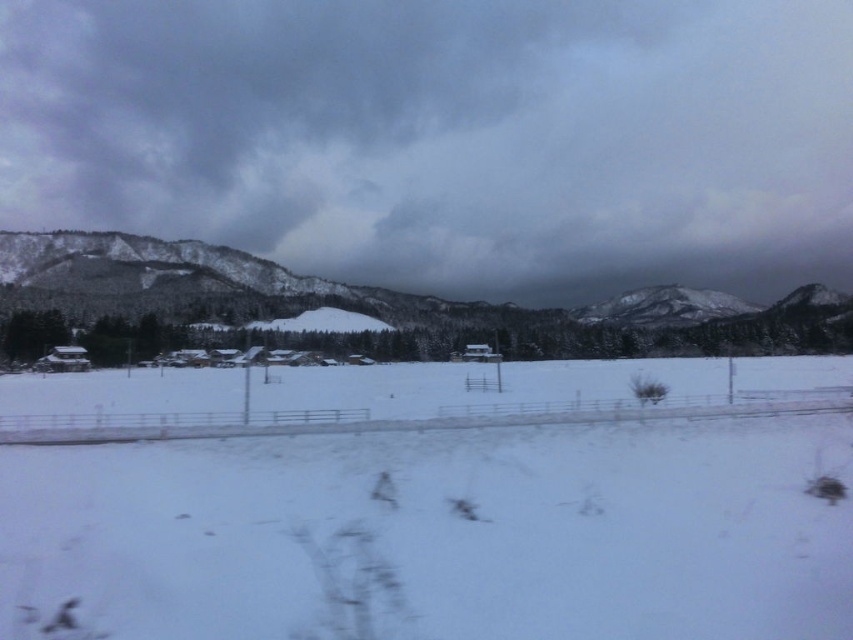
Which is above, snowy rock at center or transparent glass train window at center?

snowy rock at center is above.

Who is positioned more to the right, snowy rock at center or transparent glass train window at center?

snowy rock at center

Locate an element on the screen. This screenshot has height=640, width=853. snowy rock at center is located at coordinates (664, 307).

From the picture: Who is higher up, gray cloudy sky at upper center or snowy rock at center?

gray cloudy sky at upper center is above.

In order to click on gray cloudy sky at upper center in this screenshot , I will do `click(445, 138)`.

Between snow-covered mountain at center and transparent glass train window at center, which one appears on the right side from the viewer's perspective?

snow-covered mountain at center is more to the right.

Can you confirm if snow-covered mountain at center is taller than transparent glass train window at center?

Indeed, snow-covered mountain at center has a greater height compared to transparent glass train window at center.

Does point (467, 323) come in front of point (474, 342)?

No.

Find the location of `snow-covered mountain at center`. snow-covered mountain at center is located at coordinates (360, 308).